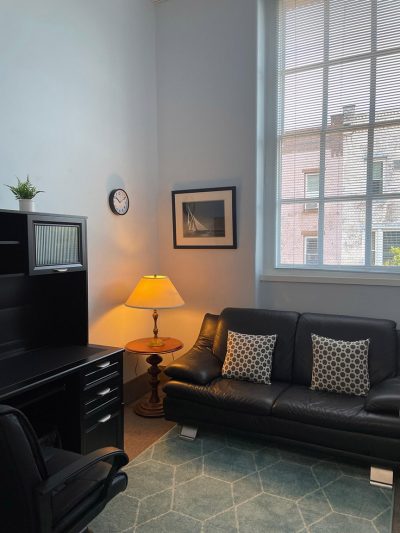
This screenshot has width=400, height=533. Identify the location of floor. (155, 423).